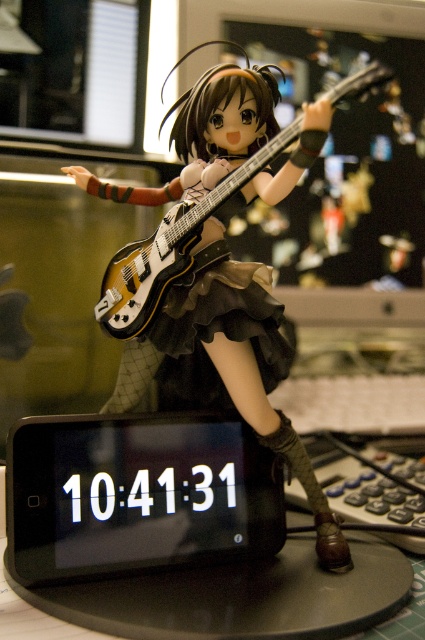
You are setting up a display for a music store. You have two guitars, the matte black guitar at center and the matte yellow electric guitar at center. The display shelf has a width of 1.2 meters. Can both guitars fit side by side on the shelf without overlapping?

The matte black guitar at center might be wider than the matte yellow electric guitar at center, so it is uncertain if both can fit side by side on the 1.2 meters wide shelf without overlapping. Measure their combined width to confirm.

You are setting up a music display in a small space. You have two guitars, the matte black guitar at center and the matte yellow electric guitar at center. Since you want to place them side by side vertically, which guitar should you position at the bottom to ensure they both fit within the display area?

The matte black guitar at center is taller than the matte yellow electric guitar at center, so you should place the shorter matte yellow electric guitar at center at the bottom to accommodate the taller matte black guitar at center above it.

In the scene shown: Please observe the image. There is a point at coordinates (x=238, y=369). What object is located at that point?

The point at coordinates (x=238, y=369) indicates the matte black guitar at center.